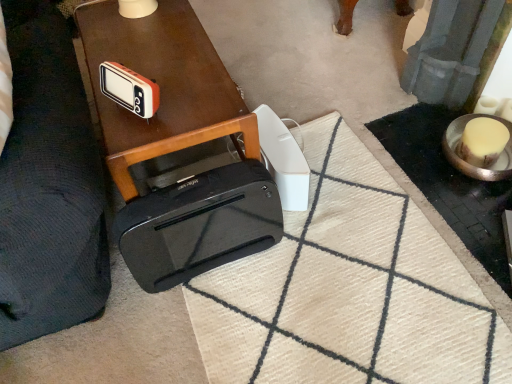
This screenshot has width=512, height=384. Describe the element at coordinates (49, 186) in the screenshot. I see `dark blue fabric couch at left` at that location.

The image size is (512, 384). Describe the element at coordinates (283, 160) in the screenshot. I see `white plastic remote control at center, which is the 2th gadget from left to right` at that location.

Where is `dark blue fabric couch at left`? dark blue fabric couch at left is located at coordinates (49, 186).

Is dark blue fabric couch at left in contact with beige textured doormat at center?

No, dark blue fabric couch at left is not making contact with beige textured doormat at center.

Based on their sizes in the image, would you say dark blue fabric couch at left is bigger or smaller than beige textured doormat at center?

Considering their sizes, dark blue fabric couch at left takes up more space than beige textured doormat at center.

Image resolution: width=512 pixels, height=384 pixels. In order to click on doormat on the right side of dark blue fabric couch at left in this screenshot , I will do `click(349, 290)`.

Considering the relative positions of dark blue fabric couch at left and beige textured doormat at center in the image provided, is dark blue fabric couch at left to the left of beige textured doormat at center from the viewer's perspective?

Yes.

Can you tell me how much orange plastic radio at upper left, which is the 1th gadget from left to right, and dark blue fabric couch at left differ in facing direction?

46.3 degrees.

Considering the sizes of objects orange plastic radio at upper left, placed as the second gadget when sorted from right to left, and dark blue fabric couch at left in the image provided, who is thinner, orange plastic radio at upper left, placed as the second gadget when sorted from right to left, or dark blue fabric couch at left?

Thinner between the two is orange plastic radio at upper left, placed as the second gadget when sorted from right to left.

Which object is further away from the camera taking this photo, orange plastic radio at upper left, arranged as the second gadget when viewed from the back, or dark blue fabric couch at left?

orange plastic radio at upper left, arranged as the second gadget when viewed from the back, is further away from the camera.

Can you confirm if shiny brown table at center is bigger than beige textured doormat at center?

Yes.

Looking at this image, considering the relative sizes of shiny brown table at center and beige textured doormat at center in the image provided, is shiny brown table at center wider than beige textured doormat at center?

Incorrect, the width of shiny brown table at center does not surpass that of beige textured doormat at center.

Is point (162, 20) closer to viewer compared to point (379, 250)?

No, (162, 20) is further to viewer.

Is shiny brown table at center not near beige textured doormat at center?

No, there isn't a large distance between shiny brown table at center and beige textured doormat at center.

Does white plastic remote control at center, positioned as the first gadget in back-to-front order, have a greater width compared to dark blue fabric couch at left?

Incorrect, the width of white plastic remote control at center, positioned as the first gadget in back-to-front order, does not surpass that of dark blue fabric couch at left.

Between white plastic remote control at center, which is the 2th gadget from left to right, and dark blue fabric couch at left, which one has less height?

With less height is white plastic remote control at center, which is the 2th gadget from left to right.

From the image's perspective, would you say white plastic remote control at center, which is the 2th gadget from left to right, is shown under dark blue fabric couch at left?

No.

From the dark blue fabric couch at left, count 2nd gadgets backward and point to it. Please provide its 2D coordinates.

[(283, 160)]

Which is correct: shiny brown table at center is inside dark blue fabric couch at left, or outside of it?

shiny brown table at center exists outside the volume of dark blue fabric couch at left.

From the image's perspective, which is above, shiny brown table at center or dark blue fabric couch at left?

From the image's view, shiny brown table at center is above.

Does shiny brown table at center come behind dark blue fabric couch at left?

Yes, shiny brown table at center is further from the camera.

Which is in front, point (123, 175) or point (52, 139)?

The point (52, 139) is more forward.

From a real-world perspective, which is physically above, orange plastic radio at upper left, which is the 1th gadget from left to right, or beige textured doormat at center?

From a 3D spatial view, orange plastic radio at upper left, which is the 1th gadget from left to right, is above.

Does point (127, 90) appear closer or farther from the camera than point (462, 369)?

Point (127, 90).

How many degrees apart are the facing directions of orange plastic radio at upper left, arranged as the second gadget when viewed from the back, and beige textured doormat at center?

They differ by 29.3 degrees in their facing directions.

From their relative heights in the image, would you say orange plastic radio at upper left, placed as the second gadget when sorted from right to left, is taller or shorter than beige textured doormat at center?

In the image, orange plastic radio at upper left, placed as the second gadget when sorted from right to left, appears to be taller than beige textured doormat at center.

Does orange plastic radio at upper left, placed as the second gadget when sorted from right to left, have a larger size compared to shiny brown table at center?

Incorrect, orange plastic radio at upper left, placed as the second gadget when sorted from right to left, is not larger than shiny brown table at center.

Considering the positions of objects orange plastic radio at upper left, acting as the 1th gadget starting from the front, and shiny brown table at center in the image provided, who is more to the left, orange plastic radio at upper left, acting as the 1th gadget starting from the front, or shiny brown table at center?

Positioned to the left is orange plastic radio at upper left, acting as the 1th gadget starting from the front.

Could you tell me if orange plastic radio at upper left, placed as the second gadget when sorted from right to left, is facing shiny brown table at center?

No.

Where is `table to the right of orange plastic radio at upper left, arranged as the second gadget when viewed from the back`? This screenshot has height=384, width=512. table to the right of orange plastic radio at upper left, arranged as the second gadget when viewed from the back is located at coordinates (161, 86).

This screenshot has height=384, width=512. Identify the location of furniture that appears above the beige textured doormat at center (from the image's perspective). (49, 186).

You are a GUI agent. You are given a task and a screenshot of the screen. Output one action in this format:
    pyautogui.click(x=<x>, y=<y>)
    Task: Click on the furniture in front of the orange plastic radio at upper left, arranged as the second gadget when viewed from the back
    The image size is (512, 384).
    Given the screenshot: What is the action you would take?
    pyautogui.click(x=49, y=186)

Looking at the image, which one is located closer to white plastic remote control at center, which is the 2th gadget from left to right, shiny brown table at center or orange plastic radio at upper left, acting as the 1th gadget starting from the front?

The object closer to white plastic remote control at center, which is the 2th gadget from left to right, is shiny brown table at center.

Which object lies further to the anchor point dark blue fabric couch at left, shiny brown table at center or orange plastic radio at upper left, which is the 1th gadget from left to right?

orange plastic radio at upper left, which is the 1th gadget from left to right.

Looking at the image, which one is located further to beige textured doormat at center, dark blue fabric couch at left or shiny brown table at center?

dark blue fabric couch at left is positioned further to the anchor beige textured doormat at center.

Estimate the real-world distances between objects in this image. Which object is closer to orange plastic radio at upper left, which is the 1th gadget from left to right, beige textured doormat at center or shiny brown table at center?

The object closer to orange plastic radio at upper left, which is the 1th gadget from left to right, is shiny brown table at center.

Based on their spatial positions, is beige textured doormat at center or dark blue fabric couch at left closer to shiny brown table at center?

The object closer to shiny brown table at center is dark blue fabric couch at left.

When comparing their distances from beige textured doormat at center, does dark blue fabric couch at left or orange plastic radio at upper left, which is the 1th gadget from left to right, seem further?

orange plastic radio at upper left, which is the 1th gadget from left to right, is further to beige textured doormat at center.

Looking at the image, which one is located further to orange plastic radio at upper left, arranged as the second gadget when viewed from the back, dark blue fabric couch at left or shiny brown table at center?

The object further to orange plastic radio at upper left, arranged as the second gadget when viewed from the back, is dark blue fabric couch at left.

From the image, which object appears to be nearer to dark blue fabric couch at left, orange plastic radio at upper left, arranged as the second gadget when viewed from the back, or shiny brown table at center?

Based on the image, shiny brown table at center appears to be nearer to dark blue fabric couch at left.

Locate an element on the screen. table between dark blue fabric couch at left and white plastic remote control at center, acting as the 1th gadget starting from the right, in the front-back direction is located at coordinates (161, 86).

Find the location of a particular element. Image resolution: width=512 pixels, height=384 pixels. gadget between dark blue fabric couch at left and shiny brown table at center along the z-axis is located at coordinates (129, 89).

The width and height of the screenshot is (512, 384). I want to click on gadget positioned between dark blue fabric couch at left and white plastic remote control at center, which is the 2th gadget from left to right, from near to far, so click(x=129, y=89).

Image resolution: width=512 pixels, height=384 pixels. What are the coordinates of `doormat between dark blue fabric couch at left and white plastic remote control at center, which is the 2th gadget from left to right, in the front-back direction` in the screenshot? It's located at (349, 290).